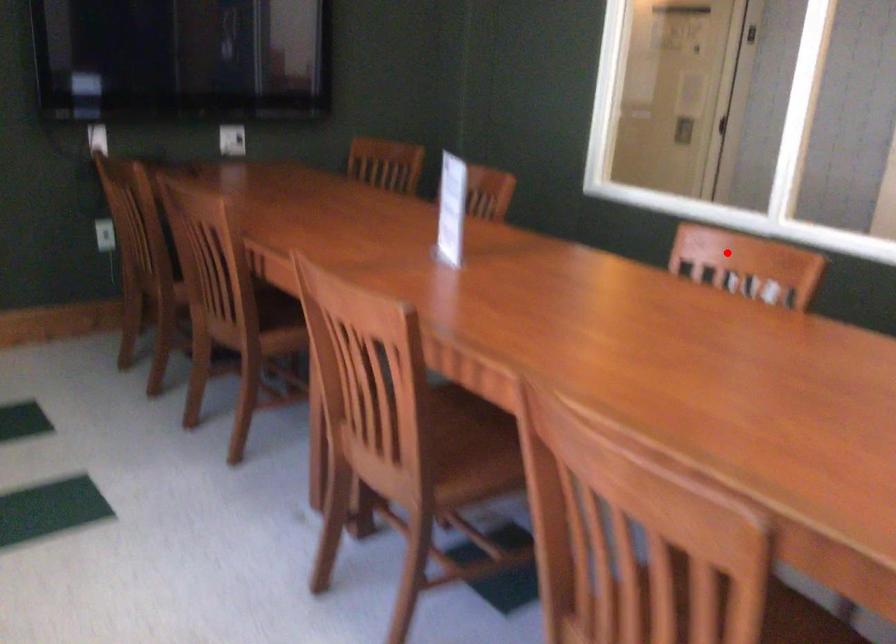
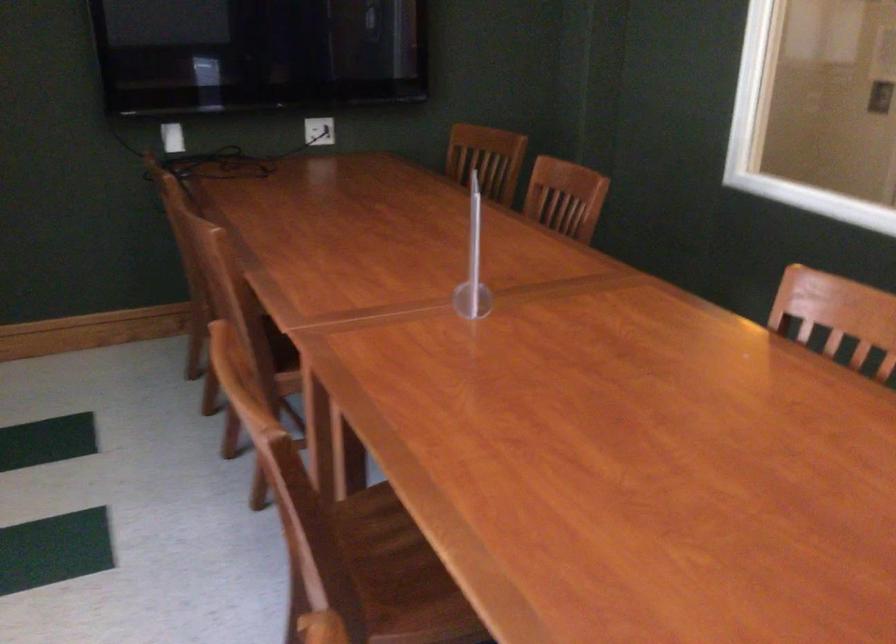
Question: I am providing you with two images of the same scene from different viewpoints. In image1, a red point is highlighted. Considering the same 3D point in image2, which of the following is correct?

Choices:
 (A) It is closer
 (B) It is farther

Answer: (A)